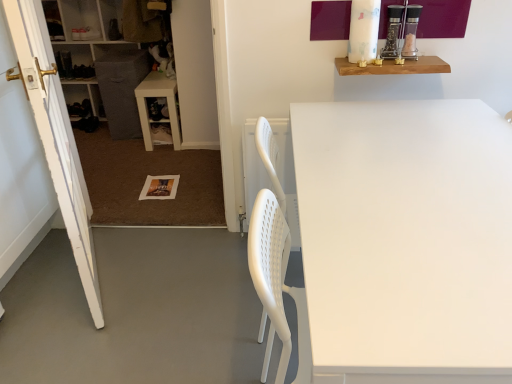
This screenshot has height=384, width=512. I want to click on blank space situated above wooden shelf at upper right (from a real-world perspective), so tap(384, 59).